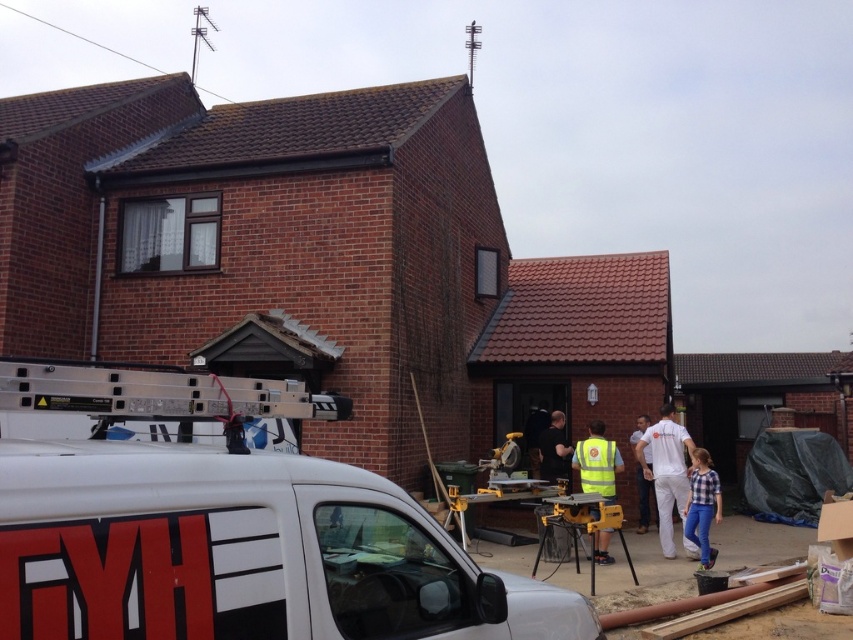
Who is positioned more to the left, reflective yellow vest at center or yellow reflective vest at center?

reflective yellow vest at center is more to the left.

Can you confirm if reflective yellow vest at center is bigger than yellow reflective vest at center?

Indeed, reflective yellow vest at center has a larger size compared to yellow reflective vest at center.

Between point (614, 497) and point (647, 506), which one is positioned in front?

Point (614, 497) is more forward.

Find the location of `reflective yellow vest at center`. reflective yellow vest at center is located at coordinates (596, 461).

Measure the distance between point (699, 532) and camera.

A distance of 9.96 meters exists between point (699, 532) and camera.

Is plaid shirt at lower right positioned behind yellow reflective vest at center?

No, plaid shirt at lower right is closer to the viewer.

In order to click on plaid shirt at lower right in this screenshot , I will do `click(701, 506)`.

Identify the location of plaid shirt at lower right. This screenshot has width=853, height=640. (701, 506).

Between point (654, 422) and point (650, 468), which one is positioned in front?

Point (650, 468) is in front.

What are the coordinates of `white cotton shirt at center` in the screenshot? It's located at (666, 472).